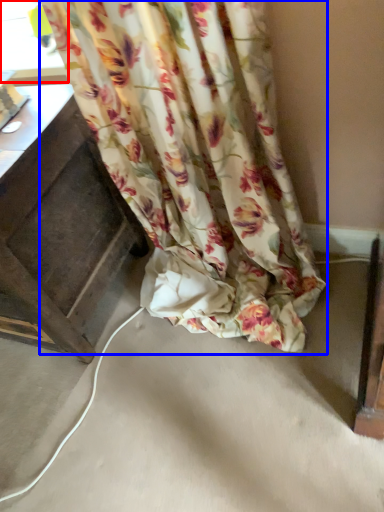
Question: Which point is further to the camera, window (highlighted by a red box) or curtain (highlighted by a blue box)?

Choices:
 (A) window
 (B) curtain

Answer: (A)